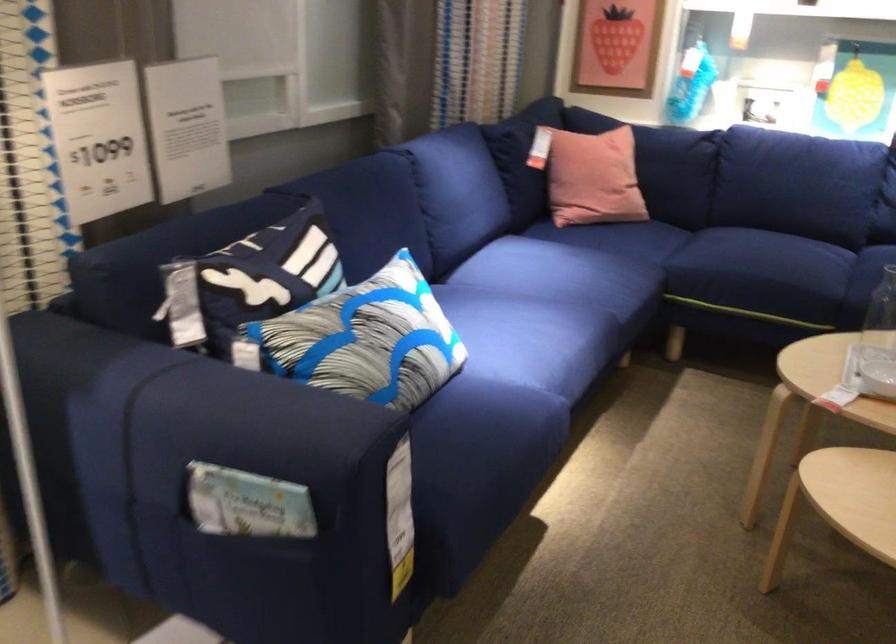
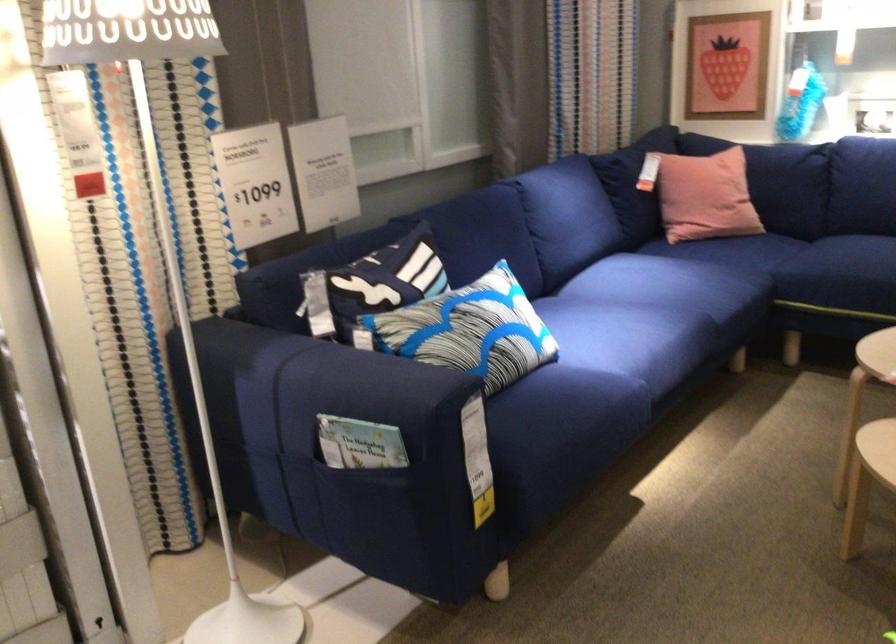
The point at (x=645, y=167) is marked in the first image. Where is the corresponding point in the second image?

(759, 176)